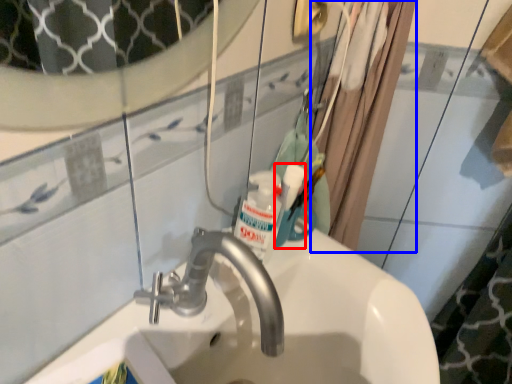
Question: Among these objects, which one is nearest to the camera, mouthwash (highlighted by a red box) or shower curtain (highlighted by a blue box)?

Choices:
 (A) mouthwash
 (B) shower curtain

Answer: (B)